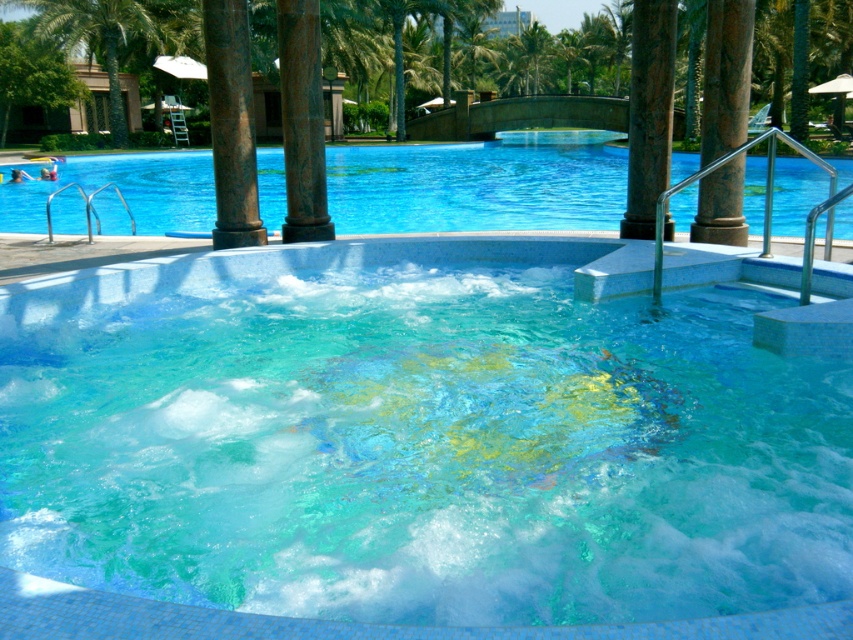
Question: Does clear glass swimming pool at center have a greater width compared to green marble pillar at center?

Choices:
 (A) no
 (B) yes

Answer: (B)

Question: Observing the image, what is the correct spatial positioning of green marble pillar at center in reference to brown stone pillar at upper center?

Choices:
 (A) below
 (B) above

Answer: (B)

Question: Which of these objects is positioned closest to the clear glass swimming pool at center?

Choices:
 (A) rusty metal pillar at center
 (B) clear blue water at upper center

Answer: (A)

Question: Estimate the real-world distances between objects in this image. Which object is farther from the clear blue water at upper center?

Choices:
 (A) green leafy palm tree at upper left
 (B) clear glass swimming pool at center
 (C) brown marble pillar at center

Answer: (C)

Question: Which of the following is the closest to the observer?

Choices:
 (A) (289, 44)
 (B) (637, 157)
 (C) (163, 170)

Answer: (A)

Question: Does clear blue water at upper center lie behind clear glass swimming pool at center?

Choices:
 (A) no
 (B) yes

Answer: (B)